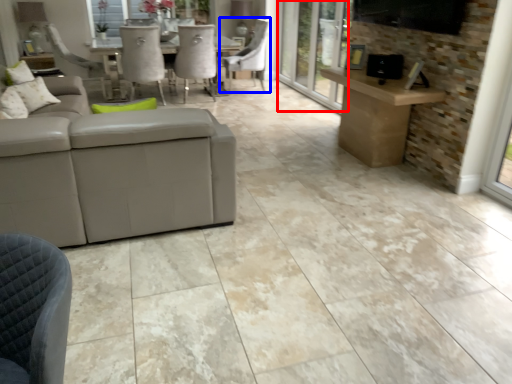
Question: Among these objects, which one is farthest to the camera, screen door (highlighted by a red box) or chair (highlighted by a blue box)?

Choices:
 (A) screen door
 (B) chair

Answer: (B)